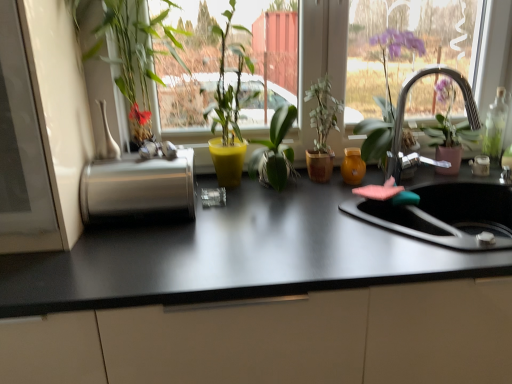
Question: Is brushed metal paper towel holder at left bigger or smaller than silver metallic faucet at upper right?

Choices:
 (A) small
 (B) big

Answer: (B)

Question: In the image, is brushed metal paper towel holder at left on the left side or the right side of silver metallic faucet at upper right?

Choices:
 (A) right
 (B) left

Answer: (B)

Question: Based on their relative distances, which object is nearer to the white glossy vase at upper left, the 1th vase when ordered from front to back?

Choices:
 (A) matte white vase at left, which appears as the 1th houseplant when viewed from the left
 (B) black matte countertop at center
 (C) transparent glass window at center
 (D) green matte plant at center, which is the first houseplant in right-to-left order
 (E) matte yellow pot at center, positioned as the 3th houseplant in right-to-left order

Answer: (A)

Question: Which object is positioned farthest from the transparent glass bottle at right?

Choices:
 (A) green matte plant at center, which is the first houseplant in right-to-left order
 (B) pink sponge at right
 (C) translucent amber glass at sink right, which is the 1th vase from right to left
 (D) white glossy vase at upper left, the 1th vase when ordered from front to back
 (E) transparent glass window at center

Answer: (D)